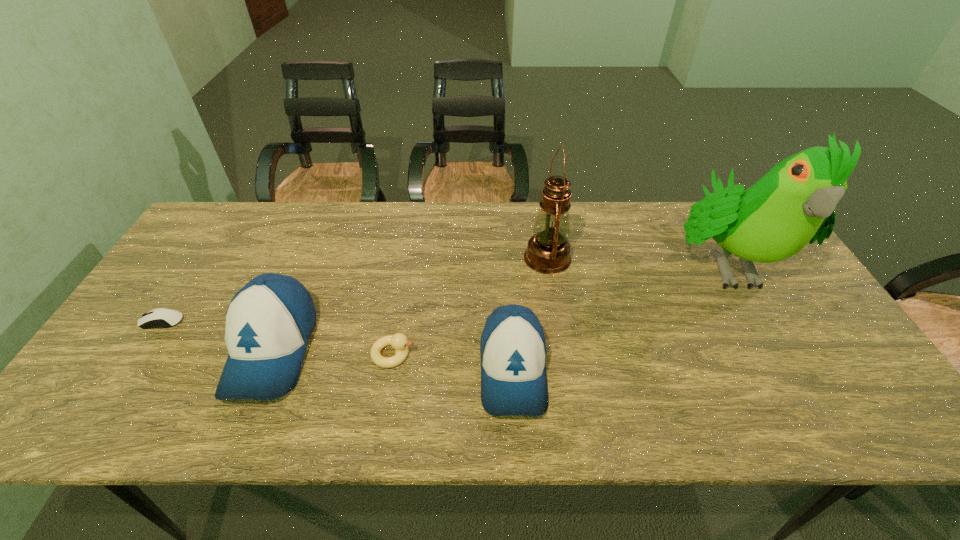
Please point a spot to add another baseball cap on the right. Please provide its 2D coordinates. Your answer should be formatted as a tuple, i.e. [(x, y)], where the tuple contains the x and y coordinates of a point satisfying the conditions above.

[(774, 393)]